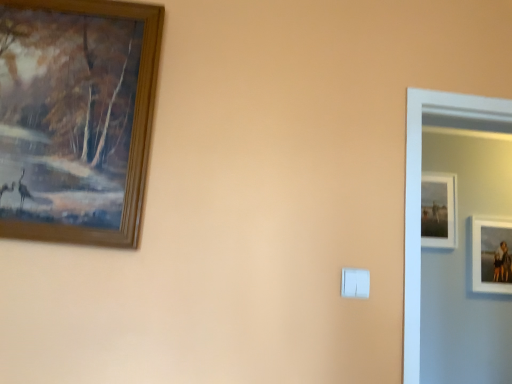
Image resolution: width=512 pixels, height=384 pixels. Describe the element at coordinates (355, 283) in the screenshot. I see `white plastic light switch at center` at that location.

You are a GUI agent. You are given a task and a screenshot of the screen. Output one action in this format:
    pyautogui.click(x=<x>, y=<y>)
    Task: Click on the white matte picture frame at right, placed as the first picture frame when sorted from right to left
    The image size is (512, 384).
    Given the screenshot: What is the action you would take?
    pyautogui.click(x=490, y=255)

Can you tell me how much matte white picture frame at upper right, the third picture frame when ordered from front to back, and white plastic light switch at center differ in facing direction?

There is a 1.12-degree angle between the facing directions of matte white picture frame at upper right, the third picture frame when ordered from front to back, and white plastic light switch at center.

From a real-world perspective, is matte white picture frame at upper right, acting as the second picture frame starting from the left, physically located above or below white plastic light switch at center?

matte white picture frame at upper right, acting as the second picture frame starting from the left, is above white plastic light switch at center.

Looking at the image, does matte white picture frame at upper right, which appears as the 1th picture frame when viewed from the back, seem bigger or smaller compared to white plastic light switch at center?

Clearly, matte white picture frame at upper right, which appears as the 1th picture frame when viewed from the back, is larger in size than white plastic light switch at center.

Between matte white picture frame at upper right, arranged as the 2th picture frame when viewed from the right, and white plastic light switch at center, which one appears on the right side from the viewer's perspective?

From the viewer's perspective, matte white picture frame at upper right, arranged as the 2th picture frame when viewed from the right, appears more on the right side.

From the image's perspective, who appears lower, wooden picture frame at upper left, which appears as the first picture frame when viewed from the front, or white matte picture frame at right, placed as the first picture frame when sorted from right to left?

white matte picture frame at right, placed as the first picture frame when sorted from right to left, from the image's perspective.

Is wooden picture frame at upper left, which appears as the first picture frame when viewed from the front, positioned beyond the bounds of white matte picture frame at right, marked as the third picture frame in a left-to-right arrangement?

Yes.

Which of these two, wooden picture frame at upper left, the first picture frame positioned from the left, or white matte picture frame at right, the second picture frame positioned from the back, is thinner?

With smaller width is white matte picture frame at right, the second picture frame positioned from the back.

Can you tell me how much wooden picture frame at upper left, the first picture frame positioned from the left, and white matte picture frame at right, placed as the first picture frame when sorted from right to left, differ in facing direction?

wooden picture frame at upper left, the first picture frame positioned from the left, and white matte picture frame at right, placed as the first picture frame when sorted from right to left, are facing 0.812 degrees away from each other.

From a real-world perspective, is white matte picture frame at right, the 2th picture frame when ordered from front to back, physically located above or below wooden picture frame at upper left, which appears as the first picture frame when viewed from the front?

white matte picture frame at right, the 2th picture frame when ordered from front to back, is below wooden picture frame at upper left, which appears as the first picture frame when viewed from the front.

Consider the image. Considering their positions, is white matte picture frame at right, placed as the first picture frame when sorted from right to left, located in front of or behind wooden picture frame at upper left, which appears as the first picture frame when viewed from the front?

white matte picture frame at right, placed as the first picture frame when sorted from right to left, is behind wooden picture frame at upper left, which appears as the first picture frame when viewed from the front.

Is white matte picture frame at right, marked as the third picture frame in a left-to-right arrangement, at the left side of wooden picture frame at upper left, the first picture frame positioned from the left?

In fact, white matte picture frame at right, marked as the third picture frame in a left-to-right arrangement, is to the right of wooden picture frame at upper left, the first picture frame positioned from the left.

Measure the distance between white matte picture frame at right, the second picture frame positioned from the back, and wooden picture frame at upper left, acting as the 3th picture frame starting from the right.

They are 2.76 meters apart.

From the image's perspective, is matte white picture frame at upper right, acting as the second picture frame starting from the left, above or below white matte picture frame at right, placed as the first picture frame when sorted from right to left?

Based on their image positions, matte white picture frame at upper right, acting as the second picture frame starting from the left, is located above white matte picture frame at right, placed as the first picture frame when sorted from right to left.

From a real-world perspective, is matte white picture frame at upper right, acting as the second picture frame starting from the left, positioned under white matte picture frame at right, the second picture frame positioned from the back, based on gravity?

No, from a real-world perspective, matte white picture frame at upper right, acting as the second picture frame starting from the left, is not below white matte picture frame at right, the second picture frame positioned from the back.

Is matte white picture frame at upper right, acting as the second picture frame starting from the left, looking in the opposite direction of white matte picture frame at right, marked as the third picture frame in a left-to-right arrangement?

No, matte white picture frame at upper right, acting as the second picture frame starting from the left, is not facing the opposite direction of white matte picture frame at right, marked as the third picture frame in a left-to-right arrangement.

Does point (456, 182) lie in front of point (511, 291)?

That is False.

Is point (507, 291) closer or farther from the camera than point (344, 284)?

Point (507, 291).

Where is `light switch that is above the white matte picture frame at right, the 2th picture frame when ordered from front to back (from the image's perspective)`? This screenshot has width=512, height=384. light switch that is above the white matte picture frame at right, the 2th picture frame when ordered from front to back (from the image's perspective) is located at coordinates (355, 283).

Looking at the image, does white matte picture frame at right, the 2th picture frame when ordered from front to back, seem bigger or smaller compared to white plastic light switch at center?

Clearly, white matte picture frame at right, the 2th picture frame when ordered from front to back, is larger in size than white plastic light switch at center.

Considering the positions of objects white matte picture frame at right, the 2th picture frame when ordered from front to back, and white plastic light switch at center in the image provided, who is in front, white matte picture frame at right, the 2th picture frame when ordered from front to back, or white plastic light switch at center?

white plastic light switch at center is in front.

Is wooden picture frame at upper left, acting as the 3th picture frame starting from the right, taller or shorter than matte white picture frame at upper right, which appears as the 1th picture frame when viewed from the back?

Clearly, wooden picture frame at upper left, acting as the 3th picture frame starting from the right, is taller compared to matte white picture frame at upper right, which appears as the 1th picture frame when viewed from the back.

Is matte white picture frame at upper right, arranged as the 2th picture frame when viewed from the right, inside wooden picture frame at upper left, acting as the 3th picture frame starting from the right?

No, matte white picture frame at upper right, arranged as the 2th picture frame when viewed from the right, is not surrounded by wooden picture frame at upper left, acting as the 3th picture frame starting from the right.

Considering the positions of objects wooden picture frame at upper left, acting as the 3th picture frame starting from the right, and matte white picture frame at upper right, acting as the second picture frame starting from the left, in the image provided, who is more to the right, wooden picture frame at upper left, acting as the 3th picture frame starting from the right, or matte white picture frame at upper right, acting as the second picture frame starting from the left,?

From the viewer's perspective, matte white picture frame at upper right, acting as the second picture frame starting from the left, appears more on the right side.

Is matte white picture frame at upper right, the third picture frame when ordered from front to back, thinner than wooden picture frame at upper left, acting as the 3th picture frame starting from the right?

Indeed, matte white picture frame at upper right, the third picture frame when ordered from front to back, has a lesser width compared to wooden picture frame at upper left, acting as the 3th picture frame starting from the right.

The width and height of the screenshot is (512, 384). What are the coordinates of `the 2nd picture frame in front of the matte white picture frame at upper right, the third picture frame when ordered from front to back` in the screenshot? It's located at (76, 118).

Is matte white picture frame at upper right, arranged as the 2th picture frame when viewed from the right, positioned with its back to wooden picture frame at upper left, the first picture frame positioned from the left?

No, matte white picture frame at upper right, arranged as the 2th picture frame when viewed from the right, is not facing away from wooden picture frame at upper left, the first picture frame positioned from the left.

Does matte white picture frame at upper right, the third picture frame when ordered from front to back, touch wooden picture frame at upper left, which is counted as the 3th picture frame, starting from the back?

No, matte white picture frame at upper right, the third picture frame when ordered from front to back, is not beside wooden picture frame at upper left, which is counted as the 3th picture frame, starting from the back.

This screenshot has width=512, height=384. What are the coordinates of `light switch below the matte white picture frame at upper right, which appears as the 1th picture frame when viewed from the back (from a real-world perspective)` in the screenshot? It's located at (355, 283).

Find the location of a particular element. The image size is (512, 384). picture frame that is the 1st object located behind the wooden picture frame at upper left, which appears as the first picture frame when viewed from the front is located at coordinates (490, 255).

When comparing their distances from white matte picture frame at right, the 2th picture frame when ordered from front to back, does wooden picture frame at upper left, the first picture frame positioned from the left, or matte white picture frame at upper right, arranged as the 2th picture frame when viewed from the right, seem closer?

matte white picture frame at upper right, arranged as the 2th picture frame when viewed from the right, is closer to white matte picture frame at right, the 2th picture frame when ordered from front to back.

From the picture: From the image, which object appears to be farther from matte white picture frame at upper right, which appears as the 1th picture frame when viewed from the back, wooden picture frame at upper left, which is counted as the 3th picture frame, starting from the back, or white plastic light switch at center?

The object further to matte white picture frame at upper right, which appears as the 1th picture frame when viewed from the back, is wooden picture frame at upper left, which is counted as the 3th picture frame, starting from the back.

From the image, which object appears to be nearer to white plastic light switch at center, white matte picture frame at right, the second picture frame positioned from the back, or wooden picture frame at upper left, acting as the 3th picture frame starting from the right?

Based on the image, wooden picture frame at upper left, acting as the 3th picture frame starting from the right, appears to be nearer to white plastic light switch at center.

Looking at the image, which one is located further to white matte picture frame at right, the 2th picture frame when ordered from front to back, matte white picture frame at upper right, the third picture frame when ordered from front to back, or white plastic light switch at center?

white plastic light switch at center.

Estimate the real-world distances between objects in this image. Which object is further from matte white picture frame at upper right, acting as the second picture frame starting from the left, white matte picture frame at right, the 2th picture frame when ordered from front to back, or wooden picture frame at upper left, which is counted as the 3th picture frame, starting from the back?

Among the two, wooden picture frame at upper left, which is counted as the 3th picture frame, starting from the back, is located further to matte white picture frame at upper right, acting as the second picture frame starting from the left.

Considering their positions, is white matte picture frame at right, the second picture frame positioned from the back, positioned further to wooden picture frame at upper left, which appears as the first picture frame when viewed from the front, than matte white picture frame at upper right, the third picture frame when ordered from front to back?

white matte picture frame at right, the second picture frame positioned from the back, lies further to wooden picture frame at upper left, which appears as the first picture frame when viewed from the front, than the other object.

When comparing their distances from wooden picture frame at upper left, which appears as the first picture frame when viewed from the front, does white matte picture frame at right, placed as the first picture frame when sorted from right to left, or white plastic light switch at center seem further?

white matte picture frame at right, placed as the first picture frame when sorted from right to left, is further to wooden picture frame at upper left, which appears as the first picture frame when viewed from the front.

Based on their spatial positions, is white plastic light switch at center or matte white picture frame at upper right, arranged as the 2th picture frame when viewed from the right, closer to wooden picture frame at upper left, which appears as the first picture frame when viewed from the front?

white plastic light switch at center is positioned closer to the anchor wooden picture frame at upper left, which appears as the first picture frame when viewed from the front.

Find the location of a particular element. picture frame positioned between white plastic light switch at center and matte white picture frame at upper right, the third picture frame when ordered from front to back, from near to far is located at coordinates (490, 255).

Identify the location of light switch between wooden picture frame at upper left, which appears as the first picture frame when viewed from the front, and white matte picture frame at right, the 2th picture frame when ordered from front to back. (355, 283).

Where is `picture frame between wooden picture frame at upper left, which appears as the first picture frame when viewed from the front, and white matte picture frame at right, the 2th picture frame when ordered from front to back, in the horizontal direction`? The width and height of the screenshot is (512, 384). picture frame between wooden picture frame at upper left, which appears as the first picture frame when viewed from the front, and white matte picture frame at right, the 2th picture frame when ordered from front to back, in the horizontal direction is located at coordinates (439, 210).

Locate an element on the screen. The width and height of the screenshot is (512, 384). light switch positioned between wooden picture frame at upper left, acting as the 3th picture frame starting from the right, and matte white picture frame at upper right, the third picture frame when ordered from front to back, from near to far is located at coordinates (355, 283).